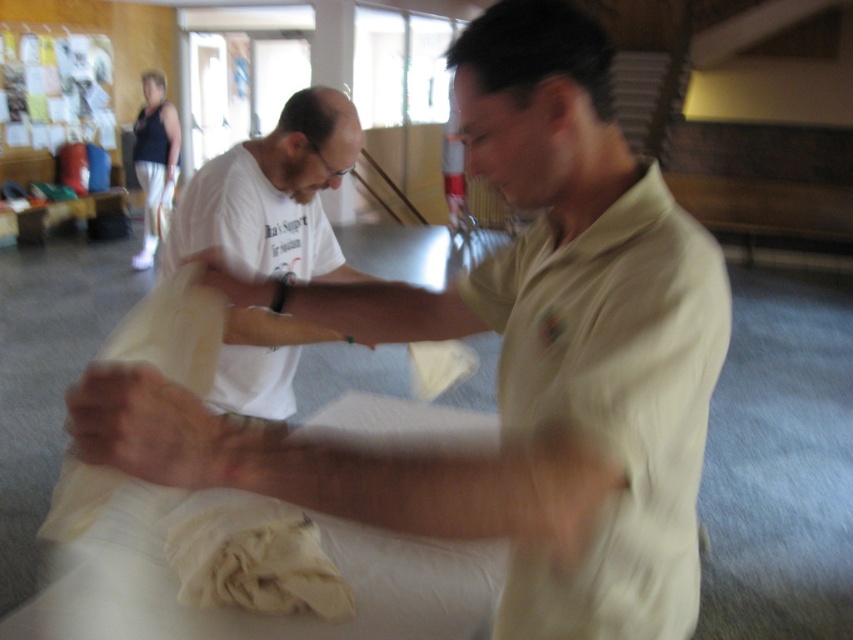
Is white cotton shirt at center wider than white fabric at center?

Yes, white cotton shirt at center is wider than white fabric at center.

Does white cotton shirt at center appear over white fabric at center?

No, white cotton shirt at center is not above white fabric at center.

Image resolution: width=853 pixels, height=640 pixels. I want to click on white cotton shirt at center, so click(x=273, y=195).

This screenshot has height=640, width=853. Identify the location of white cotton shirt at center. (273, 195).